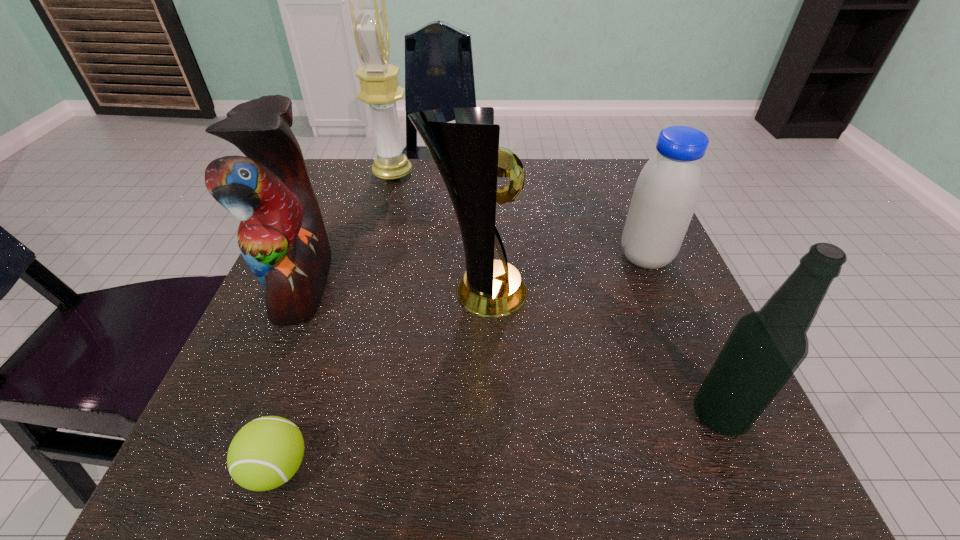
I want to click on free space that satisfies the following two spatial constraints: 1. on the front side of the fifth tallest object; 2. at the face of the parrot, so click(656, 283).